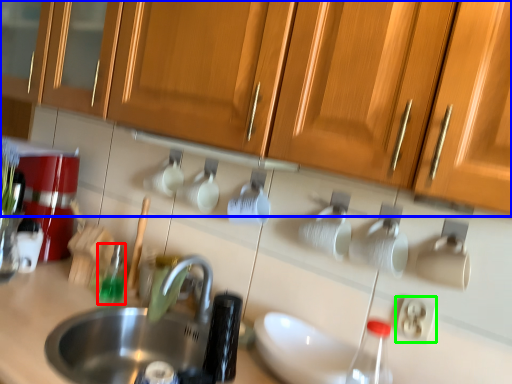
Question: Based on their relative distances, which object is nearer to bottle (highlighted by a red box)? Choose from cabinetry (highlighted by a blue box) and electric outlet (highlighted by a green box).

Choices:
 (A) cabinetry
 (B) electric outlet

Answer: (A)